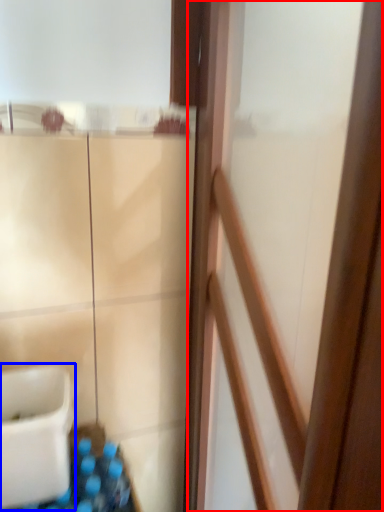
Question: Which object is closer to the camera taking this photo, screen door (highlighted by a red box) or sink (highlighted by a blue box)?

Choices:
 (A) screen door
 (B) sink

Answer: (A)